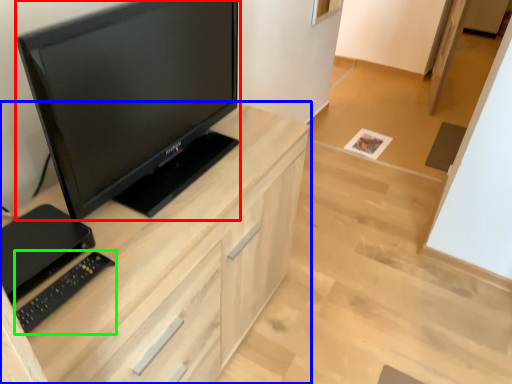
Question: Which object is positioned farthest from television (highlighted by a red box)? Select from cabinetry (highlighted by a blue box) and equipment (highlighted by a green box).

Choices:
 (A) cabinetry
 (B) equipment

Answer: (B)